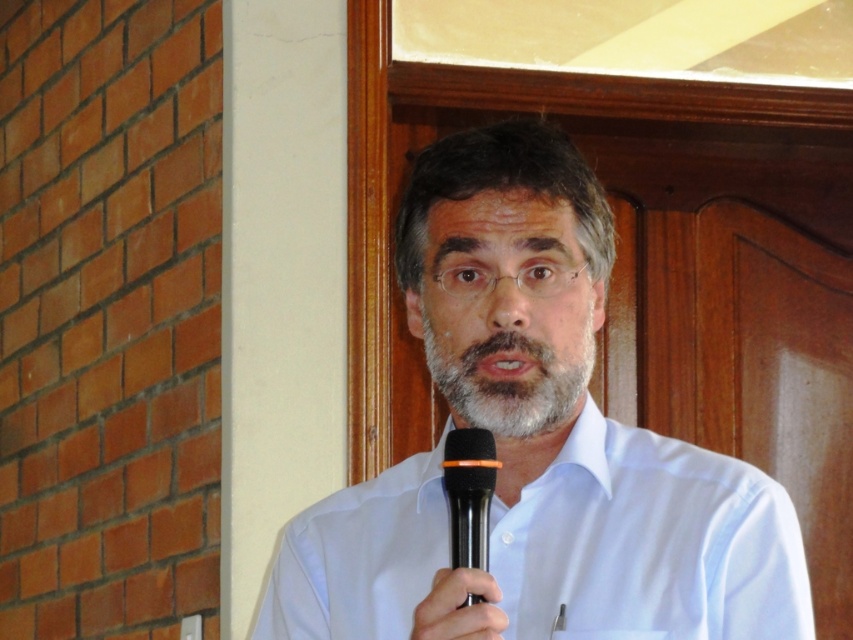
Can you confirm if black plastic microphone at center is taller than matte black microphone at center?

Yes, black plastic microphone at center is taller than matte black microphone at center.

Where is `black plastic microphone at center`? Image resolution: width=853 pixels, height=640 pixels. black plastic microphone at center is located at coordinates (468, 493).

Is point (465, 486) positioned behind point (460, 609)?

That is True.

This screenshot has height=640, width=853. What are the coordinates of `black plastic microphone at center` in the screenshot? It's located at (468, 493).

Does white smooth shirt at center lie behind matte black microphone at center?

Yes, it is behind matte black microphone at center.

Can you confirm if white smooth shirt at center is positioned to the right of matte black microphone at center?

Indeed, white smooth shirt at center is positioned on the right side of matte black microphone at center.

Is point (735, 518) positioned in front of point (430, 628)?

No, (735, 518) is further to viewer.

Locate an element on the screen. white smooth shirt at center is located at coordinates (648, 544).

Does gray matte beard at center appear on the left side of black plastic microphone at center?

In fact, gray matte beard at center is to the right of black plastic microphone at center.

Between point (561, 403) and point (457, 545), which one is positioned behind?

The point (561, 403) is more distant.

This screenshot has width=853, height=640. I want to click on gray matte beard at center, so click(x=512, y=380).